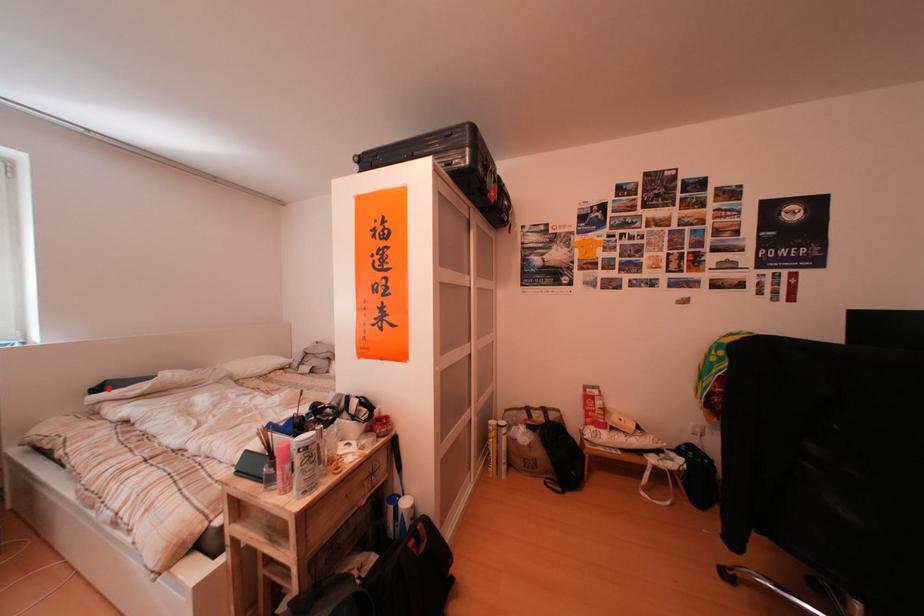
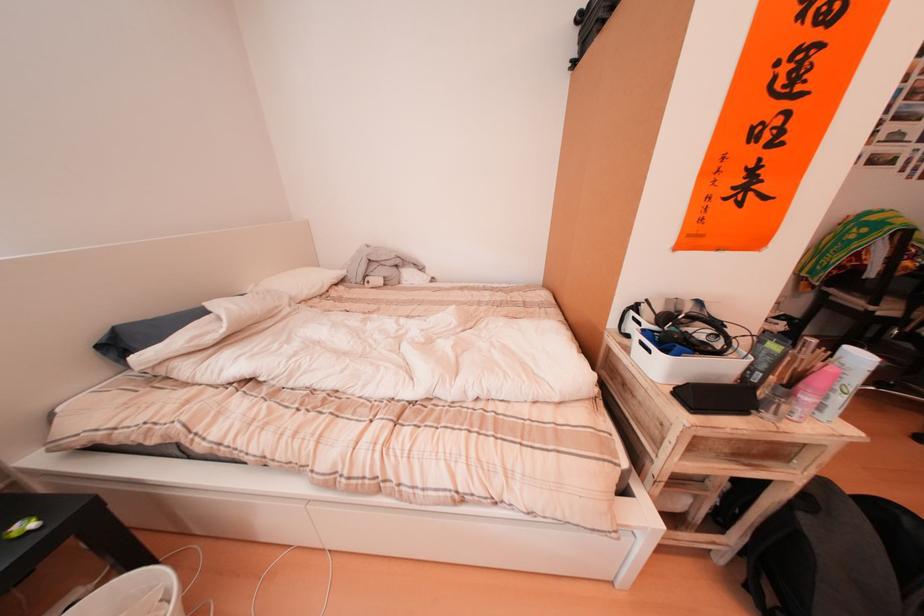
Where in the second image is the point corresponding to the highlighted location from the first image?

(105, 339)